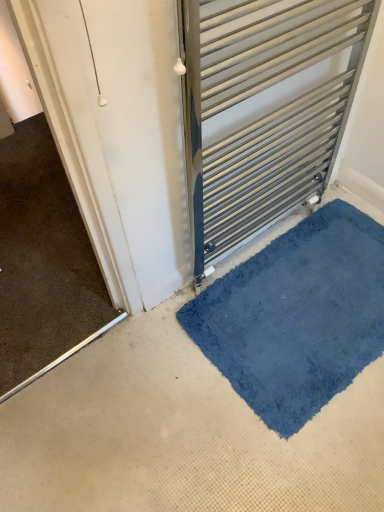
The height and width of the screenshot is (512, 384). I want to click on vacant point to the left of blue plush bath mat at lower right, so coord(121,399).